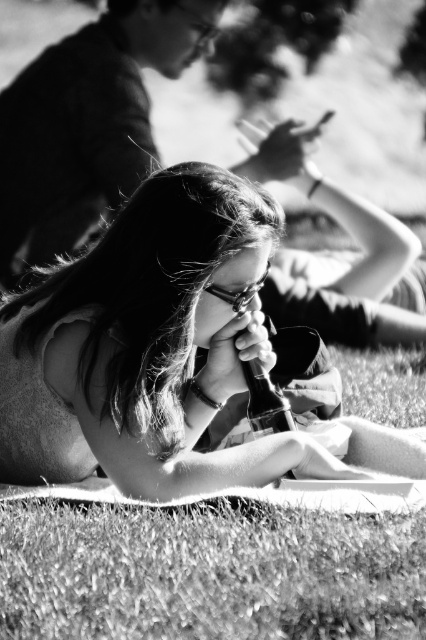
You are planning to place a smooth glass bottle at center on top of the grassy at lower center. Based on the description, will the bottle fit on the grassy area without falling over?

The smooth glass bottle at center might be wider than grassy at lower center, so there is a possibility that the bottle will not fit properly and may tip over.

Based on the scene description, where is the smooth glass bottle at center located in terms of coordinates?

The smooth glass bottle at center is located at coordinates (164, 355).